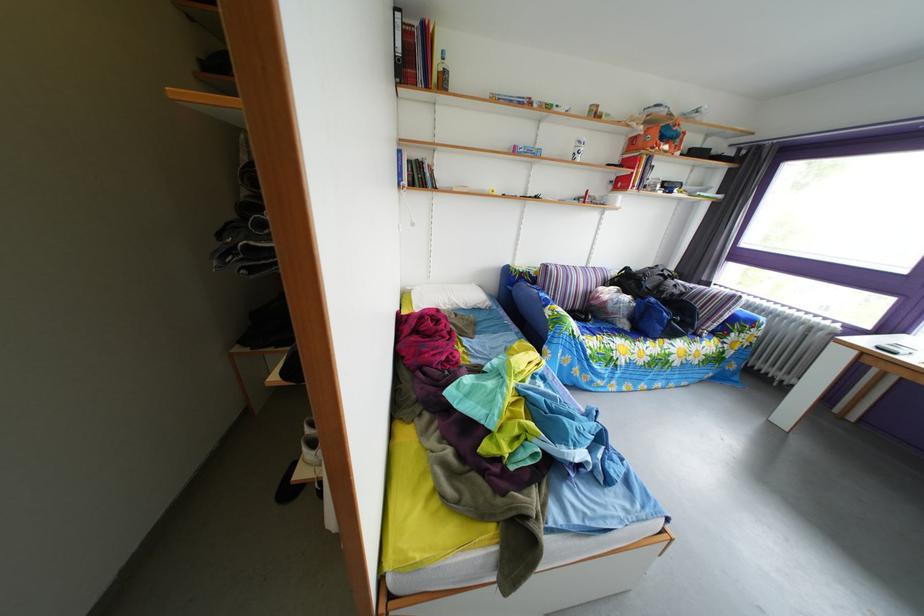
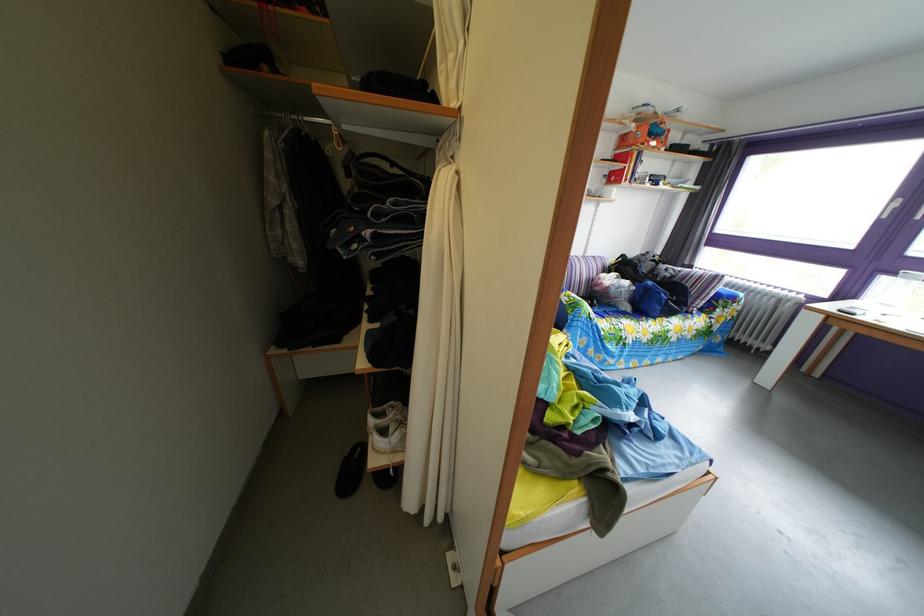
Where in the second image is the point corresponding to pixel 625 187 from the first image?

(618, 180)